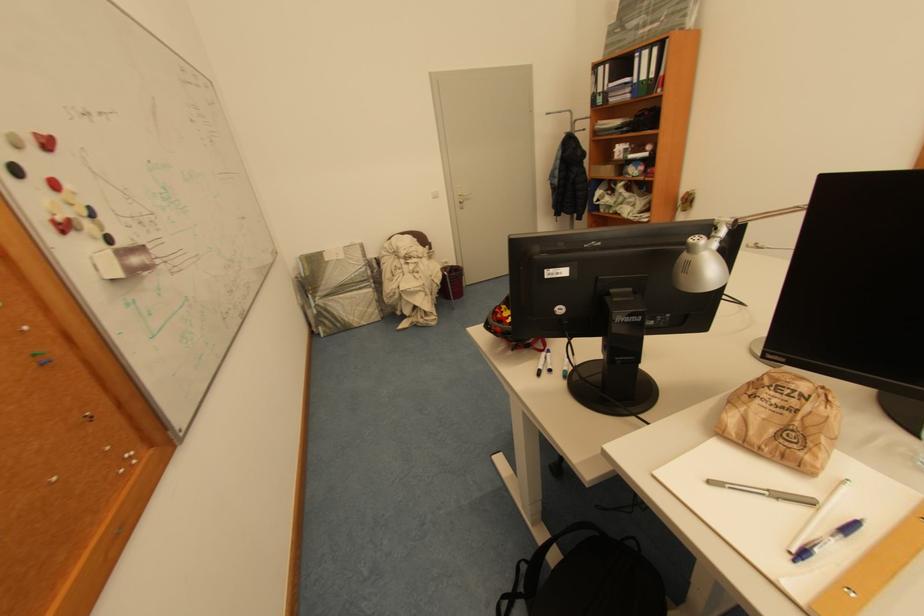
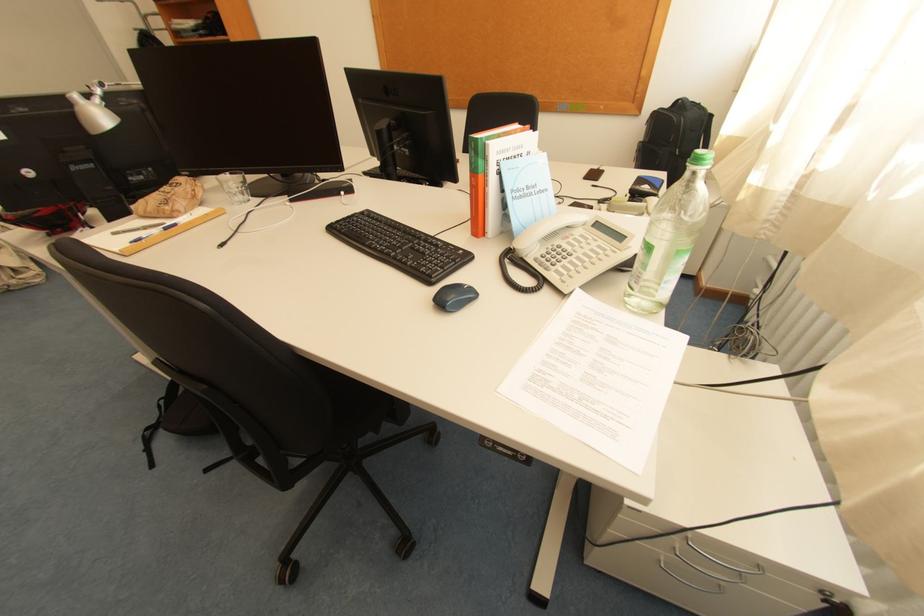
Where in the second image is the point corresponding to pixel 865 525 from the first image?

(184, 225)